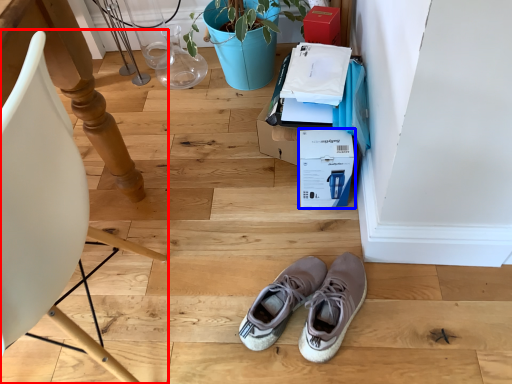
Question: Among these objects, which one is farthest to the camera, chair (highlighted by a red box) or cardboard box (highlighted by a blue box)?

Choices:
 (A) chair
 (B) cardboard box

Answer: (B)